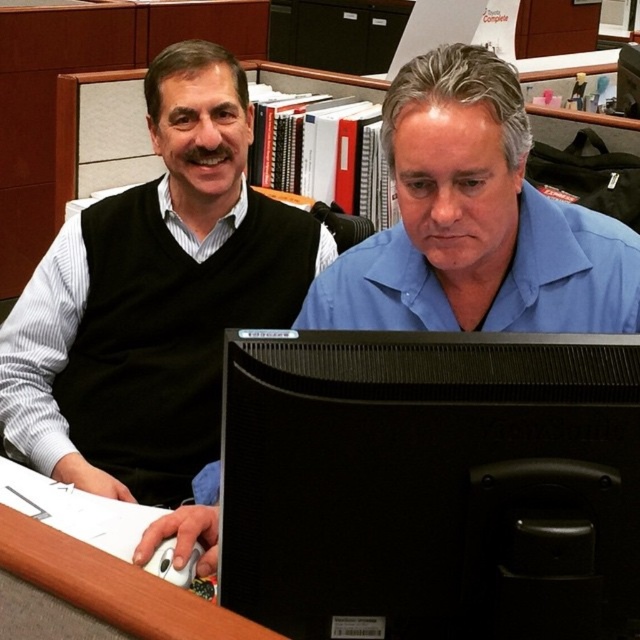
Question: Which point is farther to the camera?

Choices:
 (A) (484, 320)
 (B) (372, 464)

Answer: (A)

Question: Which object appears farthest from the camera in this image?

Choices:
 (A) black glossy computer monitor at center
 (B) blue smooth shirt at center

Answer: (B)

Question: Which object appears farthest from the camera in this image?

Choices:
 (A) black glossy computer monitor at center
 (B) blue smooth shirt at center

Answer: (B)

Question: In this image, where is black glossy computer monitor at center located relative to blue smooth shirt at center?

Choices:
 (A) above
 (B) below

Answer: (B)

Question: Does black glossy computer monitor at center appear on the left side of blue smooth shirt at center?

Choices:
 (A) no
 (B) yes

Answer: (B)

Question: Does black glossy computer monitor at center come in front of blue smooth shirt at center?

Choices:
 (A) no
 (B) yes

Answer: (B)